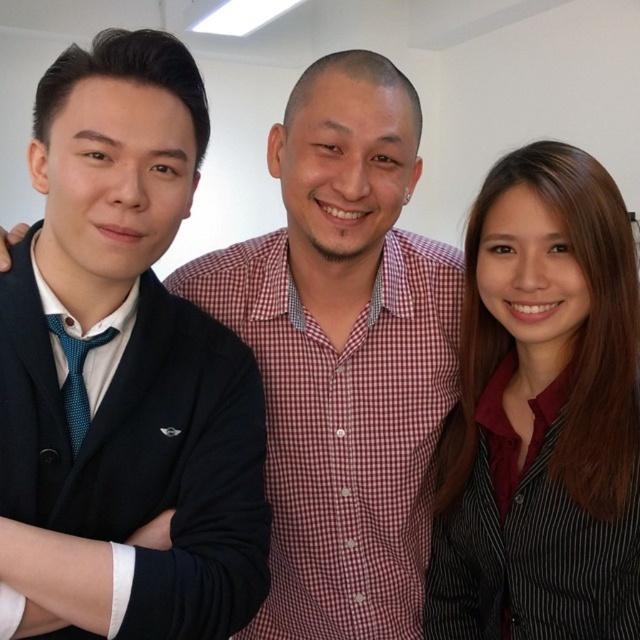
You are a photographer setting up for a group photo. You need to adjust the camera height so that the top of the black striped shirt at right and the matte black blazer at left are at the same level in the frame. Which object should you adjust the camera height based on?

The black striped shirt at right is taller than the matte black blazer at left, so you should adjust the camera height based on the black striped shirt at right to ensure both tops reach the same level in the frame.

Please describe the position of the black striped shirt at right relative to the point marked at coordinates (541, 413).

The point marked at coordinates (541, 413) corresponds to the black striped shirt at right.